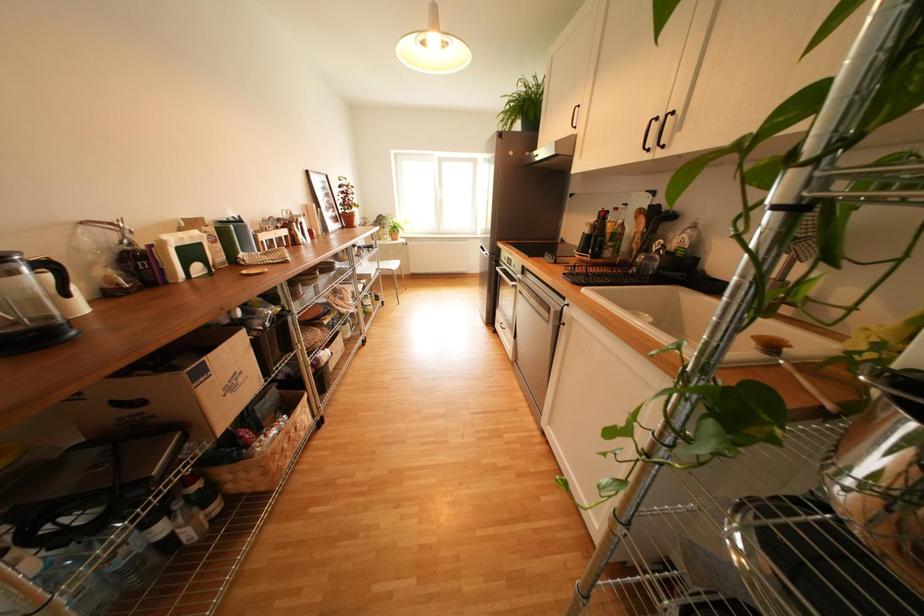
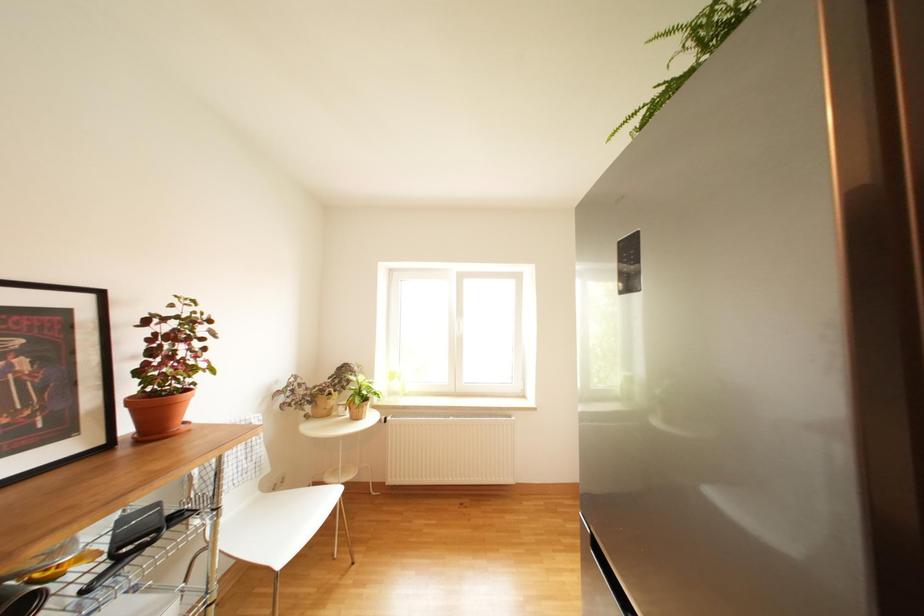
Question: What movement of the cameraman would produce the second image?

Choices:
 (A) Left
 (B) Right
 (C) Forward
 (D) Backward

Answer: (C)